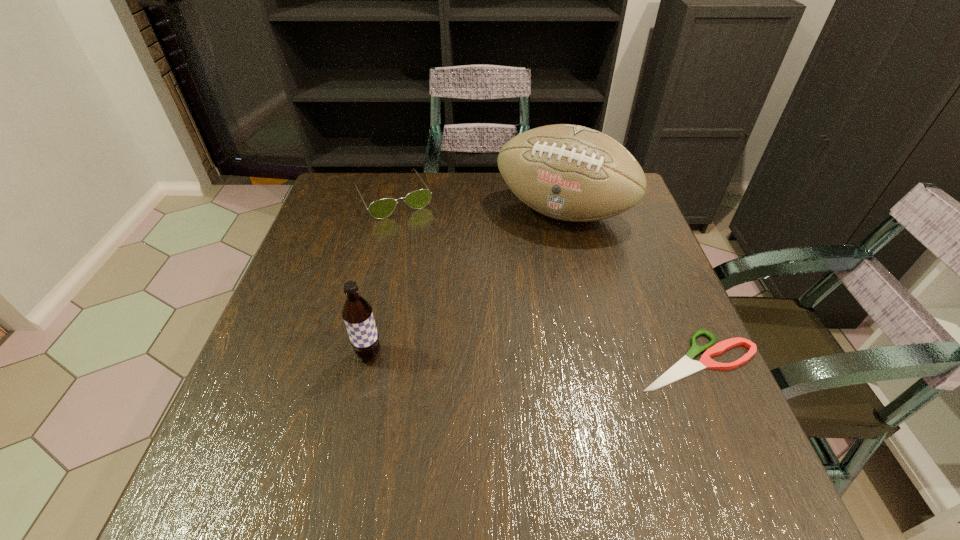
At what (x,y) coordinates should I click in order to perform the action: click on root beer. Please return your answer as a coordinate pair (x, y). This screenshot has width=960, height=540. Looking at the image, I should click on (357, 313).

You are a GUI agent. You are given a task and a screenshot of the screen. Output one action in this format:
    pyautogui.click(x=<x>, y=<y>)
    Task: Click on the scissors
    Image resolution: width=960 pixels, height=540 pixels.
    Given the screenshot: What is the action you would take?
    pyautogui.click(x=685, y=366)

At what (x,y) coordinates should I click in order to perform the action: click on football (American). Please return your answer as a coordinate pair (x, y). Looking at the image, I should click on point(573,173).

At what (x,y) coordinates should I click in order to perform the action: click on sunglasses. Please return your answer as a coordinate pair (x, y). This screenshot has height=540, width=960. Looking at the image, I should click on [x=380, y=209].

Find the location of `free space located 0.050m on the left of the third shortest object`. free space located 0.050m on the left of the third shortest object is located at coordinates (330, 355).

Identify the location of vacant space located on the back of the scissors. The image size is (960, 540). (673, 304).

You are a GUI agent. You are given a task and a screenshot of the screen. Output one action in this format:
    pyautogui.click(x=<x>, y=<y>)
    Task: Click on the blank area located on the laces of the tallest object
    The height and width of the screenshot is (540, 960).
    Given the screenshot: What is the action you would take?
    pyautogui.click(x=485, y=355)

Locate an element on the screen. free region located on the laces of the tallest object is located at coordinates (533, 258).

Locate an element on the screen. This screenshot has height=540, width=960. free space located 0.160m on the laces of the tallest object is located at coordinates (522, 278).

Where is `vacant space located 0.260m on the front-facing side of the third tallest object`? This screenshot has height=540, width=960. vacant space located 0.260m on the front-facing side of the third tallest object is located at coordinates (442, 279).